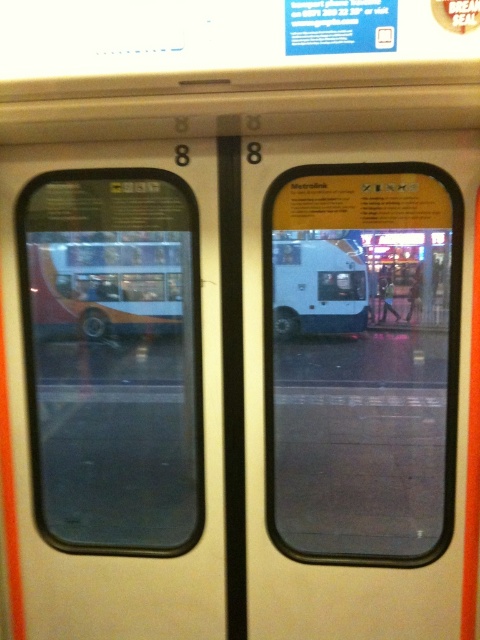
Question: Estimate the real-world distances between objects in this image. Which object is farther from the metallic silver bus at left?

Choices:
 (A) white matte bus at right
 (B) transparent glass window at left

Answer: (A)

Question: Which point is closer to the camera taking this photo?

Choices:
 (A) (108, 480)
 (B) (418, 230)
 (C) (342, 308)

Answer: (B)

Question: Is transparent glass window at right to the right of transparent glass window at left from the viewer's perspective?

Choices:
 (A) no
 (B) yes

Answer: (B)

Question: Observing the image, what is the correct spatial positioning of transparent glass window at right in reference to white matte coach at right?

Choices:
 (A) right
 (B) left

Answer: (B)

Question: Does transparent glass window at right have a smaller size compared to orange/yellow metallic bus at left?

Choices:
 (A) no
 (B) yes

Answer: (A)

Question: Which point appears closest to the camera in this image?

Choices:
 (A) (80, 243)
 (B) (382, 298)
 (C) (325, 248)
 (D) (310, 332)

Answer: (C)